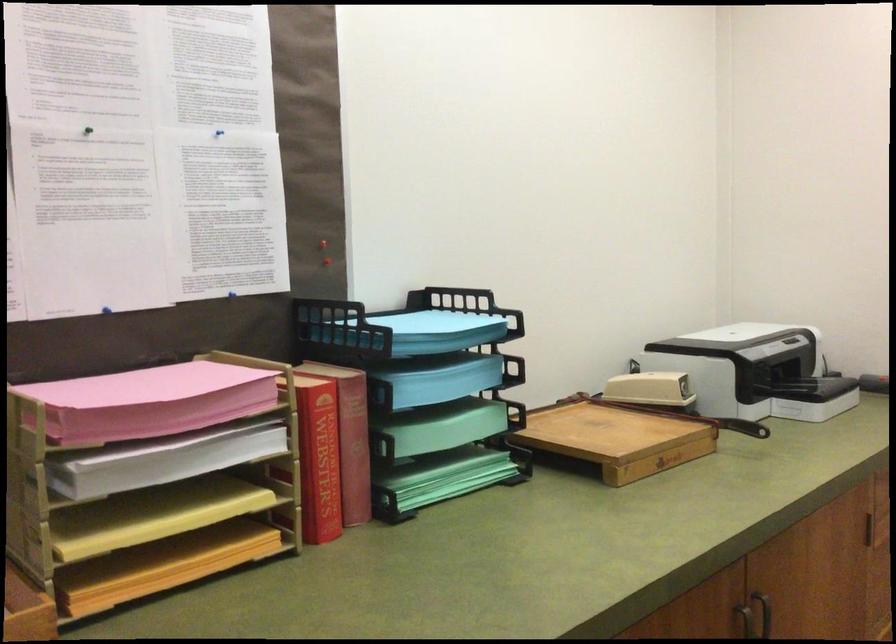
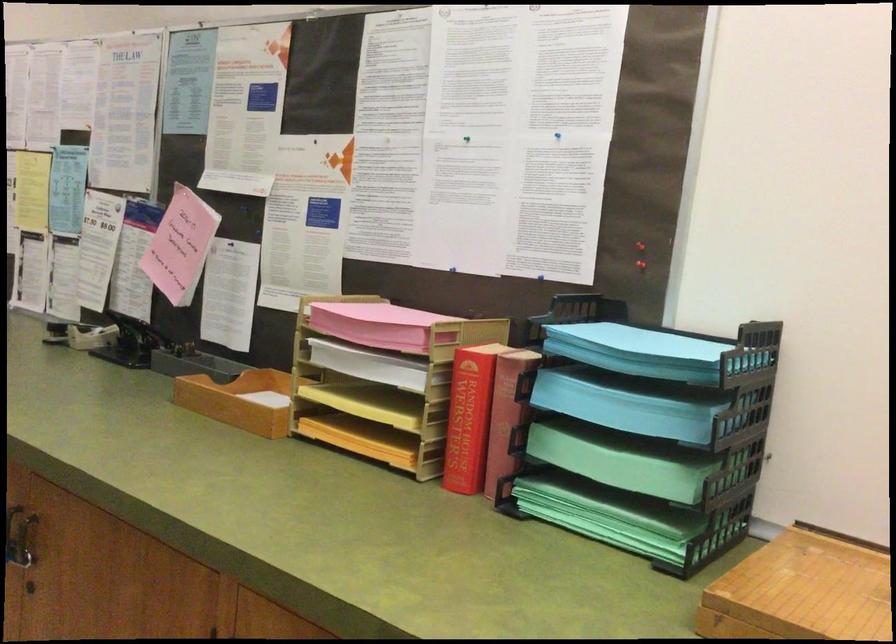
Where in the second image is the point corresponding to point 156,523 from the first image?

(367, 404)